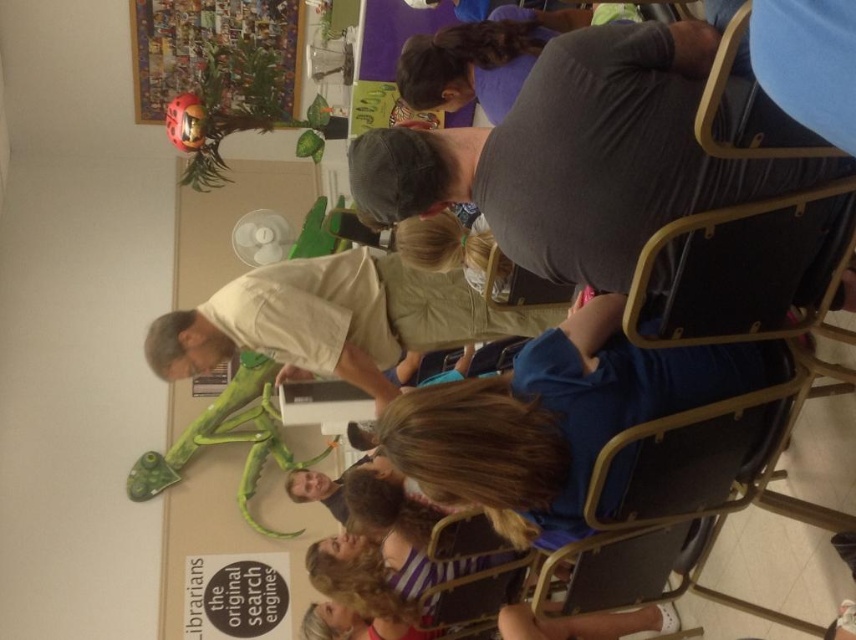
Is point (480, 144) closer to viewer compared to point (328, 288)?

Yes, point (480, 144) is in front of point (328, 288).

From the picture: Can you confirm if gray cotton shirt at upper center is smaller than light beige shirt at center?

Yes.

Who is more distant from viewer, (652, 141) or (302, 369)?

The point (302, 369) is more distant.

Where is `gray cotton shirt at upper center`? gray cotton shirt at upper center is located at coordinates click(x=580, y=156).

Which is behind, point (473, 320) or point (161, 44)?

The point (161, 44) is more distant.

Does light beige shirt at center appear on the left side of metallic silver puzzle at upper left?

Incorrect, light beige shirt at center is not on the left side of metallic silver puzzle at upper left.

Image resolution: width=856 pixels, height=640 pixels. Describe the element at coordinates (334, 317) in the screenshot. I see `light beige shirt at center` at that location.

The height and width of the screenshot is (640, 856). Identify the location of light beige shirt at center. (334, 317).

I want to click on gray cotton shirt at upper center, so click(x=580, y=156).

Can you confirm if gray cotton shirt at upper center is positioned above metallic silver puzzle at upper left?

Incorrect, gray cotton shirt at upper center is not positioned above metallic silver puzzle at upper left.

Describe the element at coordinates (580, 156) in the screenshot. The width and height of the screenshot is (856, 640). I see `gray cotton shirt at upper center` at that location.

Locate an element on the screen. gray cotton shirt at upper center is located at coordinates (580, 156).